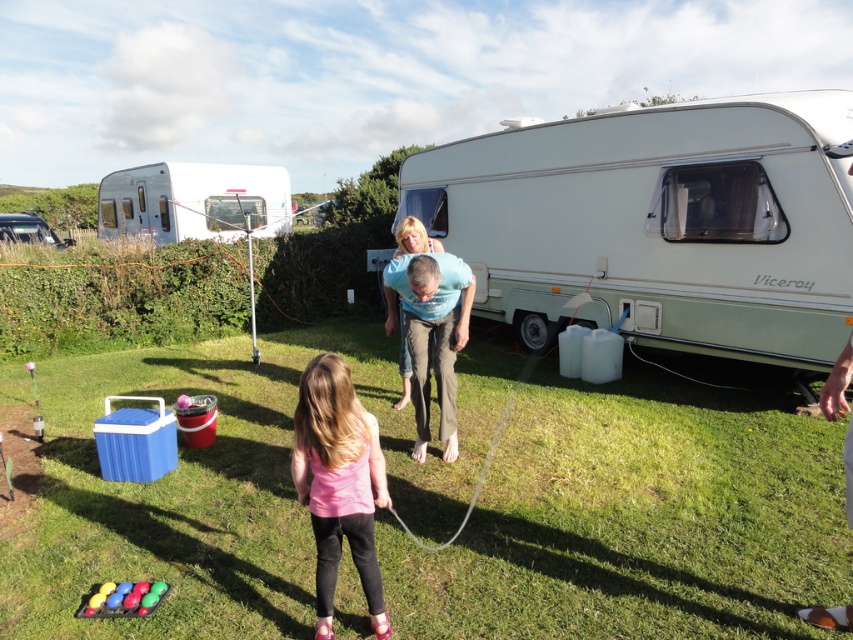
You are a photographer trying to capture the pink matte tank top at center and the green grass at center in the same frame. Which object will appear taller in the photo?

The pink matte tank top at center appears taller than the green grass at center in the photo because the description states that the green grass at center is shorter than the pink matte tank top at center.

What is the location of the point with coordinates (659, 224) in the image?

The point with coordinates (659, 224) is located on the white plastic recreational vehicle at center.